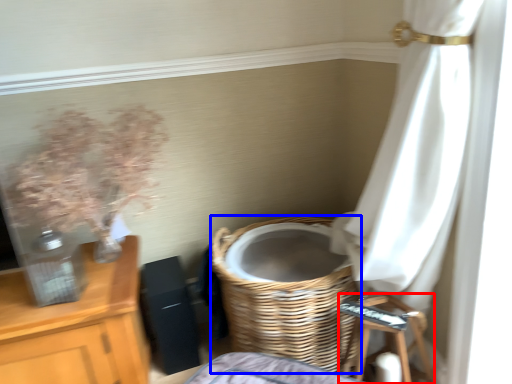
Question: Which point is further to the camera, step stool (highlighted by a red box) or basket (highlighted by a blue box)?

Choices:
 (A) step stool
 (B) basket

Answer: (B)